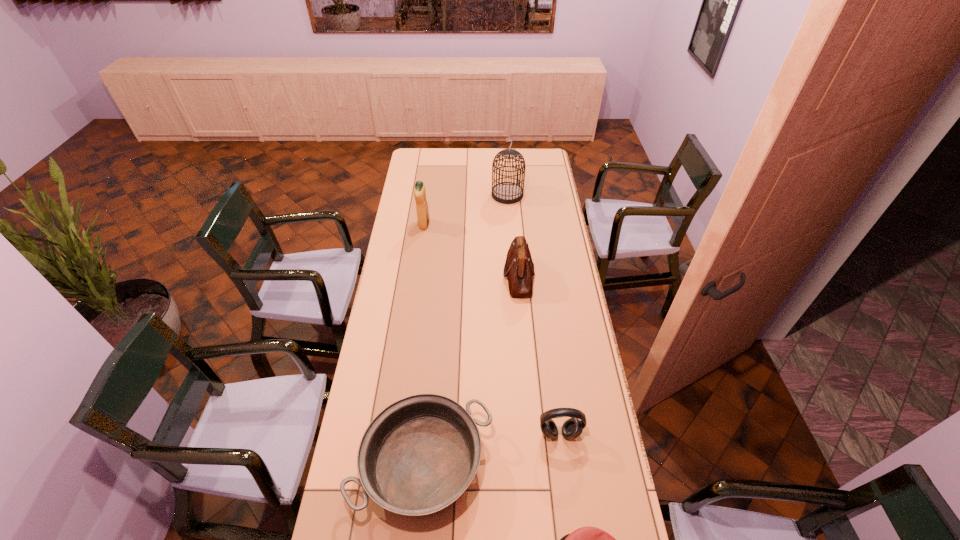
This screenshot has height=540, width=960. I want to click on vacant region between the fifth tallest object and the third shortest object, so click(x=492, y=449).

The image size is (960, 540). I want to click on free space between the farthest object and the fourth nearest object, so click(513, 235).

You are a GUI agent. You are given a task and a screenshot of the screen. Output one action in this format:
    pyautogui.click(x=<x>, y=<y>)
    Task: Click on the free space between the farthest object and the pan
    
    Given the screenshot: What is the action you would take?
    pos(466,329)

Locate an element on the screen. vacant region between the second shortest object and the shoulder bag is located at coordinates (471, 370).

Locate an element on the screen. This screenshot has height=540, width=960. vacant area between the third farthest object and the fourth tallest object is located at coordinates (540, 355).

You are a GUI agent. You are given a task and a screenshot of the screen. Output one action in this format:
    pyautogui.click(x=<x>, y=<y>)
    Task: Click on the empty space between the birdcage and the shoulder bag
    This screenshot has width=960, height=540.
    Given the screenshot: What is the action you would take?
    pyautogui.click(x=513, y=235)

Locate an element on the screen. vacant space that's between the pan and the third shortest object is located at coordinates (492, 449).

Locate an element on the screen. This screenshot has height=540, width=960. free space between the fifth nearest object and the farthest object is located at coordinates (466, 210).

I want to click on the fourth closest object to the nearest object, so click(x=419, y=190).

Locate an element on the screen. This screenshot has width=960, height=540. object that is the third closest to the pan is located at coordinates (519, 268).